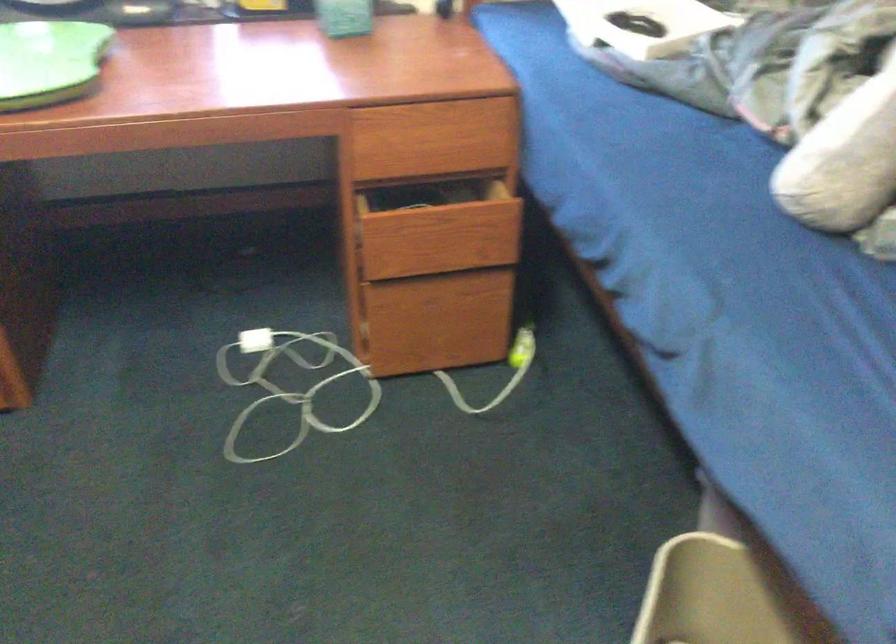
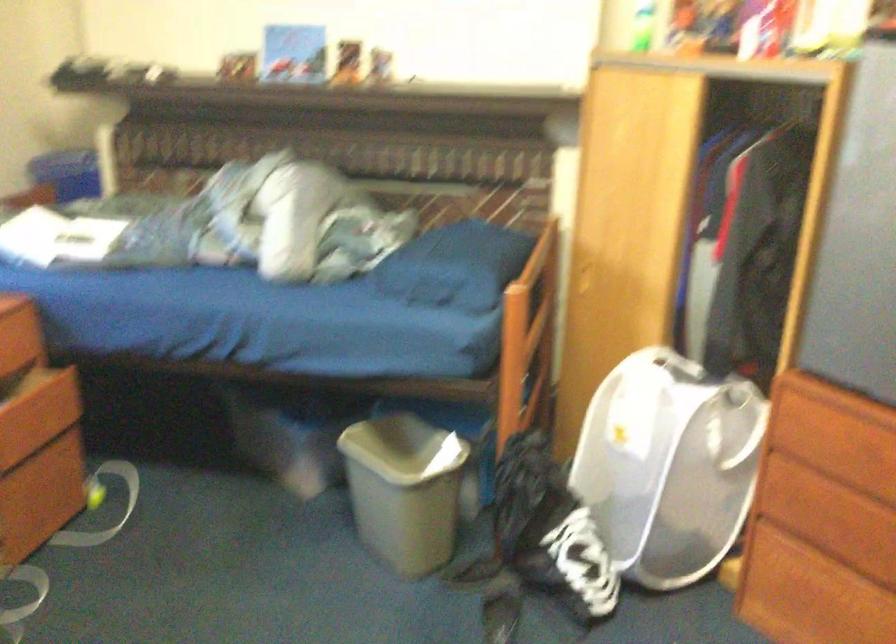
Where in the second image is the point corresponding to pixel 440 310 from the first image?

(39, 482)